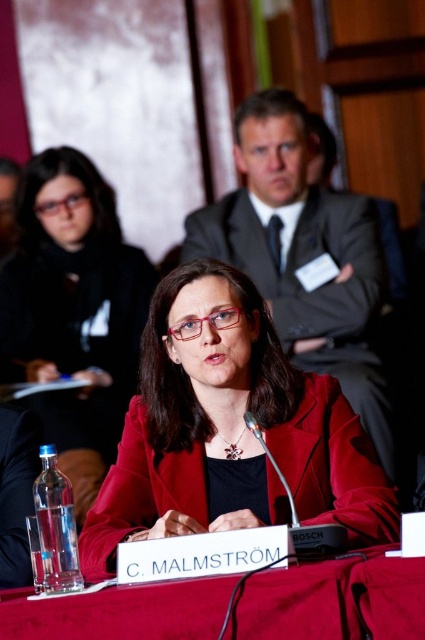
Question: Is matte gray suit at center wider than smooth red table at center?

Choices:
 (A) no
 (B) yes

Answer: (B)

Question: Observing the image, what is the correct spatial positioning of matte red jacket at center in reference to matte black jacket at center?

Choices:
 (A) below
 (B) above

Answer: (A)

Question: Considering the real-world distances, which object is closest to the smooth red table at center?

Choices:
 (A) matte black jacket at center
 (B) matte gray suit at center

Answer: (B)

Question: Which of the following is the farthest from the observer?

Choices:
 (A) (14, 320)
 (B) (269, 132)

Answer: (A)

Question: Which point is closer to the camera?

Choices:
 (A) (263, 611)
 (B) (178, 534)
 (C) (312, 323)

Answer: (A)

Question: Is matte black jacket at center closer to camera compared to smooth red table at center?

Choices:
 (A) yes
 (B) no

Answer: (B)